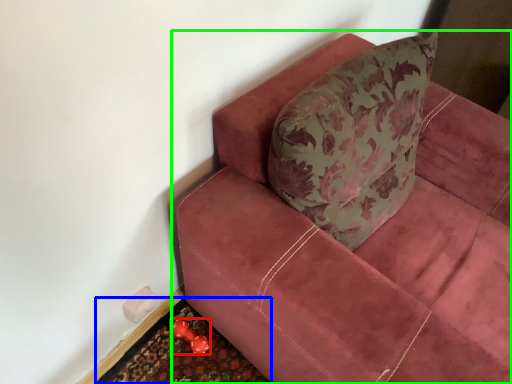
Question: Which object is positioned farthest from toy (highlighted by a red box)? Select from doormat (highlighted by a blue box) and studio couch (highlighted by a green box).

Choices:
 (A) doormat
 (B) studio couch

Answer: (B)